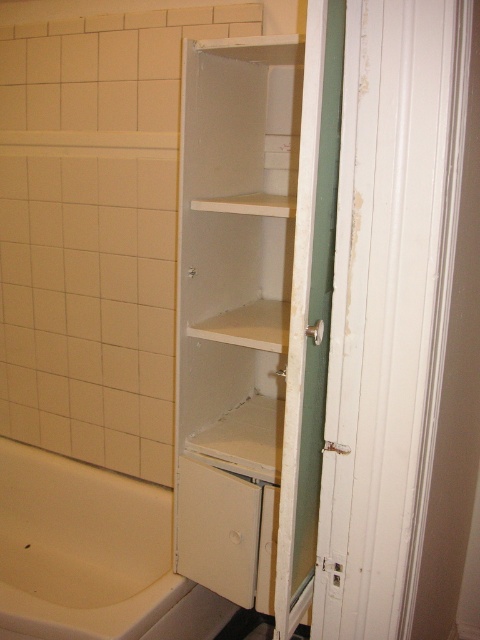
Question: Which point is farther to the camera?

Choices:
 (A) (204, 561)
 (B) (259, 340)
 (C) (19, 634)
 (D) (468, 308)

Answer: (A)

Question: Does white painted wood screen door at right come behind white matte shelf at center?

Choices:
 (A) yes
 (B) no

Answer: (B)

Question: Does white painted wood screen door at right appear under white matte cabinet at center?

Choices:
 (A) no
 (B) yes

Answer: (B)

Question: Which point is closer to the camera?

Choices:
 (A) coord(402,81)
 (B) coord(54,460)

Answer: (A)

Question: Estimate the real-world distances between objects in this image. Which object is farther from the white matte cabinet at center?

Choices:
 (A) white matte shelf at center
 (B) white glossy bathtub at lower left
 (C) white painted wood screen door at right

Answer: (B)

Question: Is white painted wood screen door at right wider than white matte cabinet at center?

Choices:
 (A) yes
 (B) no

Answer: (A)